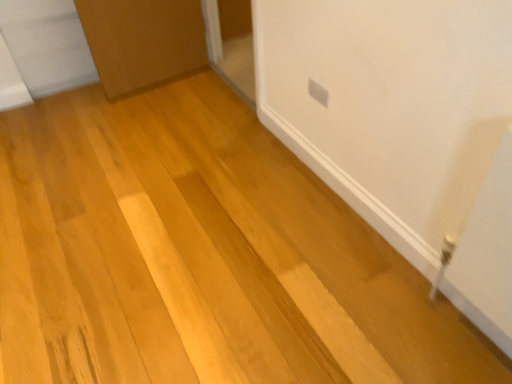
Where is `white glossy door at upper center`? The image size is (512, 384). white glossy door at upper center is located at coordinates (231, 44).

Measure the distance between point (250, 62) and camera.

The depth of point (250, 62) is 10.05 feet.

Describe the element at coordinates (231, 44) in the screenshot. The height and width of the screenshot is (384, 512). I see `white glossy door at upper center` at that location.

Image resolution: width=512 pixels, height=384 pixels. In order to click on white glossy door at upper center in this screenshot , I will do `click(231, 44)`.